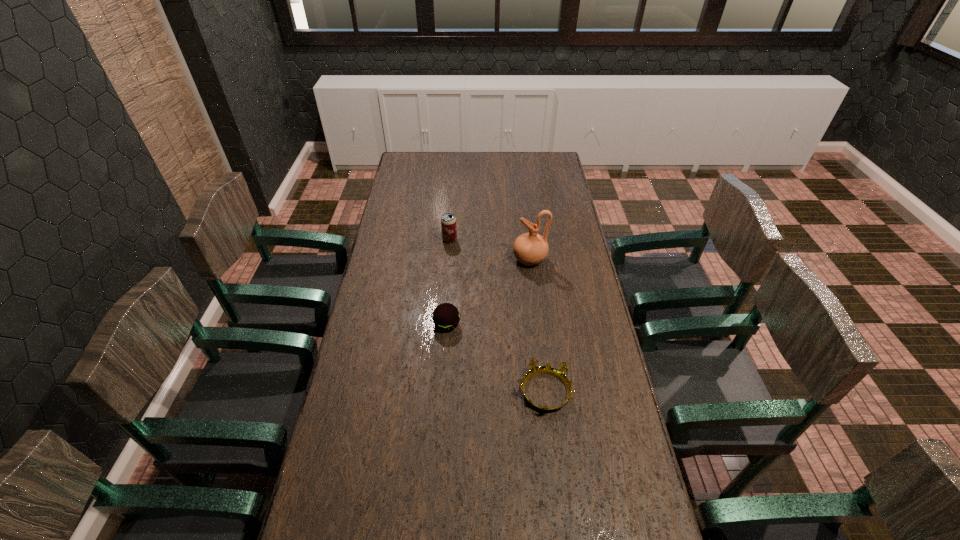
Identify the location of free space at the far right corner. (552, 164).

Find the location of a particular element. The image size is (960, 540). free area in between the second tallest object and the second farthest object is located at coordinates (490, 249).

Image resolution: width=960 pixels, height=540 pixels. What are the coordinates of `free space that is in between the beer can and the patty` in the screenshot? It's located at (448, 282).

Locate an element on the screen. free space that is in between the beer can and the nearest object is located at coordinates (497, 316).

Image resolution: width=960 pixels, height=540 pixels. I want to click on free area in between the second tallest object and the second nearest object, so click(x=448, y=282).

This screenshot has width=960, height=540. Find the location of `vacant space that's between the tallest object and the third tallest object`. vacant space that's between the tallest object and the third tallest object is located at coordinates coord(489,292).

The image size is (960, 540). I want to click on empty space between the beer can and the patty, so click(448, 282).

Find the location of `free space between the beer can and the second nearest object`. free space between the beer can and the second nearest object is located at coordinates (448, 282).

The height and width of the screenshot is (540, 960). I want to click on empty location between the tallest object and the farthest object, so click(490, 249).

Identify the location of blank region between the second shortest object and the nearest object. The height and width of the screenshot is (540, 960). (495, 358).